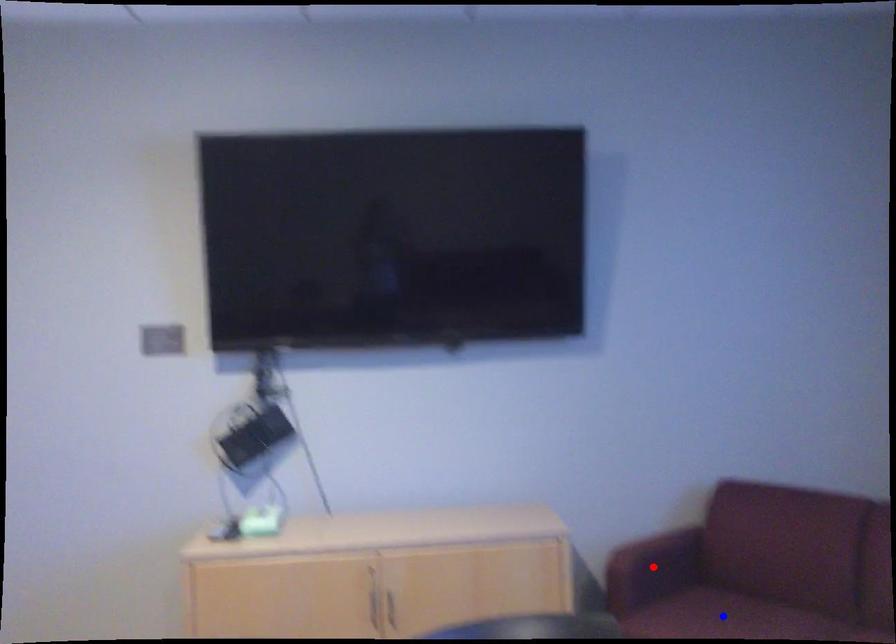
Question: Two points are marked on the image. Which point is closer to the camera?

Choices:
 (A) Blue point is closer.
 (B) Red point is closer.

Answer: (A)